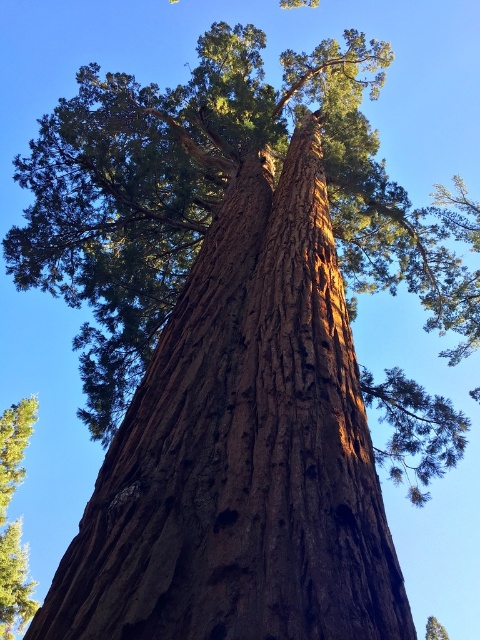
Is point (9, 554) in front of point (433, 621)?

Yes, point (9, 554) is in front of point (433, 621).

Which is more to the left, smooth brown bark at center or green textured tree at upper center?

Positioned to the left is smooth brown bark at center.

Locate an element on the screen. The image size is (480, 640). smooth brown bark at center is located at coordinates (13, 582).